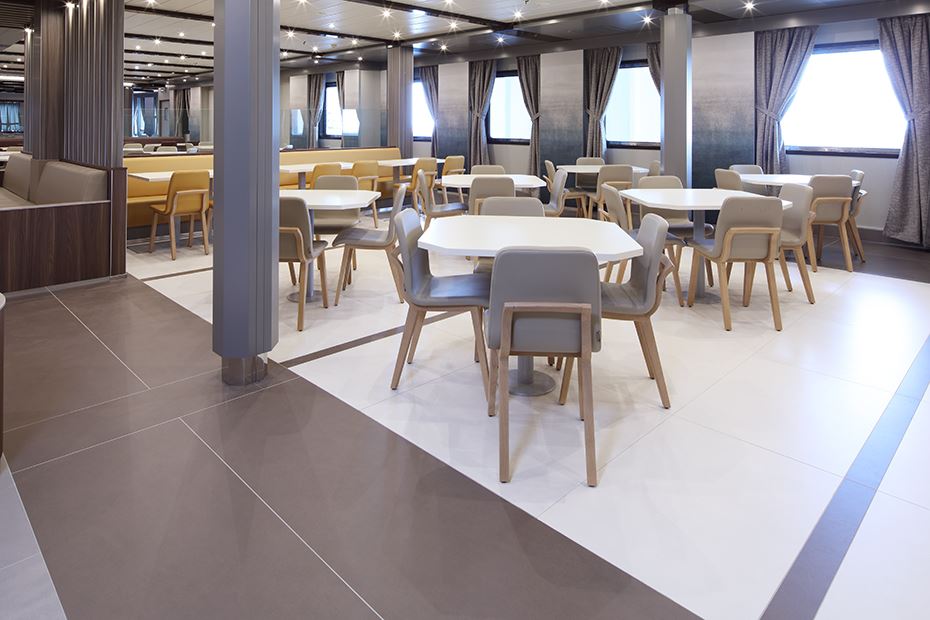
You are a GUI agent. You are given a task and a screenshot of the screen. Output one action in this format:
    pyautogui.click(x=<x>, y=<y>)
    Task: Click on the columns
    This screenshot has width=930, height=620.
    Given the screenshot: What is the action you would take?
    pyautogui.click(x=249, y=152), pyautogui.click(x=394, y=89), pyautogui.click(x=675, y=95), pyautogui.click(x=50, y=93)